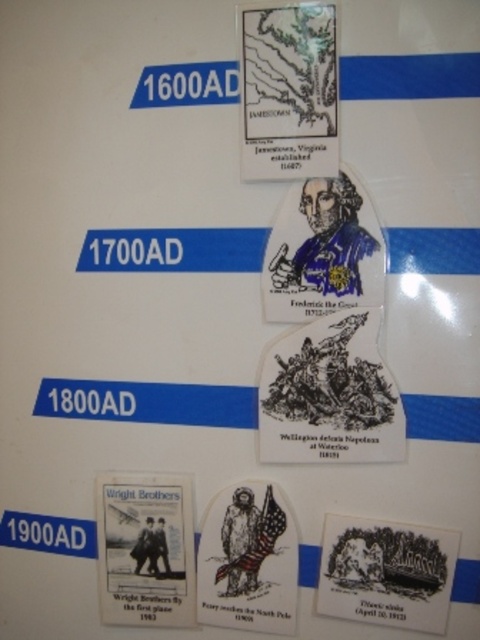
Which is above, black ink drawing of a scene at lower right or white paper flag at lower center?

Positioned higher is white paper flag at lower center.

Does black ink drawing of a scene at lower right have a larger size compared to white paper flag at lower center?

Correct, black ink drawing of a scene at lower right is larger in size than white paper flag at lower center.

Identify the location of black ink drawing of a scene at lower right. This screenshot has height=640, width=480. (386, 572).

Between white paper wright brothers poster at lower left and black ink drawing of a scene at lower right, which one has less height?

black ink drawing of a scene at lower right

Which is more to the left, white paper wright brothers poster at lower left or black ink drawing of a scene at lower right?

Positioned to the left is white paper wright brothers poster at lower left.

I want to click on white paper wright brothers poster at lower left, so tap(145, 548).

Locate an element on the screen. The width and height of the screenshot is (480, 640). white paper wright brothers poster at lower left is located at coordinates (145, 548).

Is the position of matte paper map at upper center less distant than that of white paper flag at lower center?

Yes, it is in front of white paper flag at lower center.

Between point (249, 74) and point (256, 547), which one is positioned in front?

Point (249, 74) is in front.

Which is in front, point (262, 29) or point (268, 540)?

Point (262, 29) is in front.

You are a GUI agent. You are given a task and a screenshot of the screen. Output one action in this format:
    pyautogui.click(x=<x>, y=<y>)
    Task: Click on the matte paper map at upper center
    The width and height of the screenshot is (480, 640).
    Given the screenshot: What is the action you would take?
    pyautogui.click(x=288, y=92)